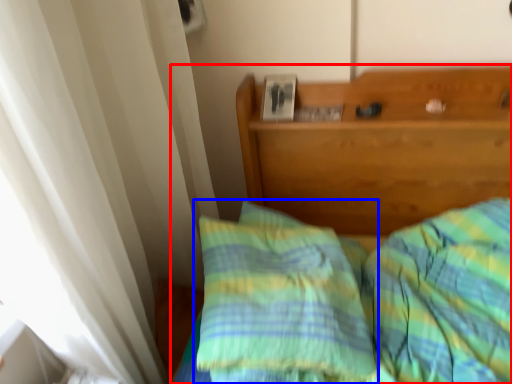
Question: Which object appears closest to the camera in this image, bed (highlighted by a red box) or pillow (highlighted by a blue box)?

Choices:
 (A) bed
 (B) pillow

Answer: (A)